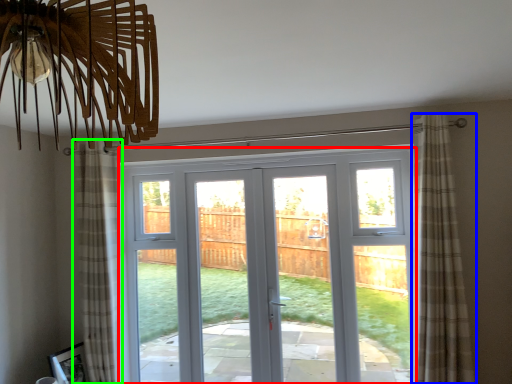
Question: Which object is positioned closest to door (highlighted by a red box)? Select from curtain (highlighted by a blue box) and curtain (highlighted by a green box).

Choices:
 (A) curtain
 (B) curtain

Answer: (A)